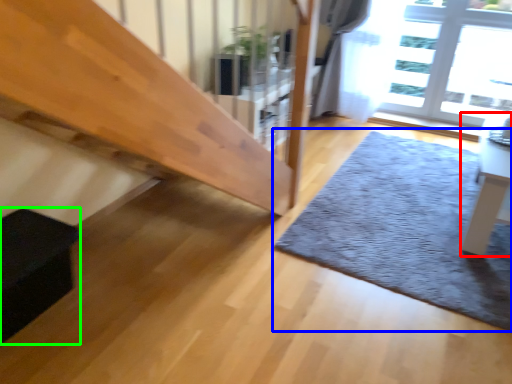
Question: Based on their relative distances, which object is farther from table (highlighted by a red box)? Choose from mat (highlighted by a blue box) and furniture (highlighted by a green box).

Choices:
 (A) mat
 (B) furniture

Answer: (B)